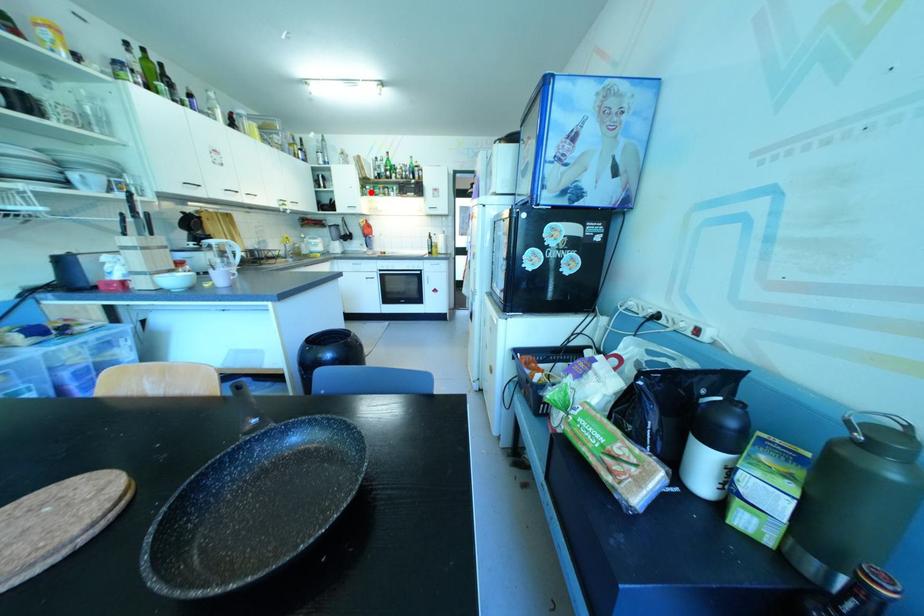
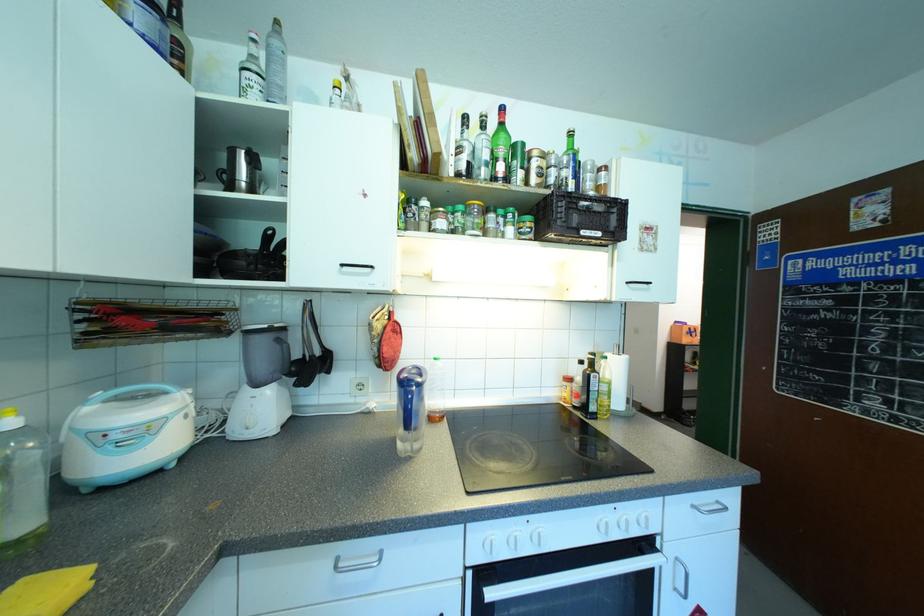
Question: A red point is marked in image1. In image2, is the corresponding 3D point closer to the camera or farther? Reply with the corresponding letter.

Choices:
 (A) The corresponding 3D point is closer.
 (B) The corresponding 3D point is farther.

Answer: (B)